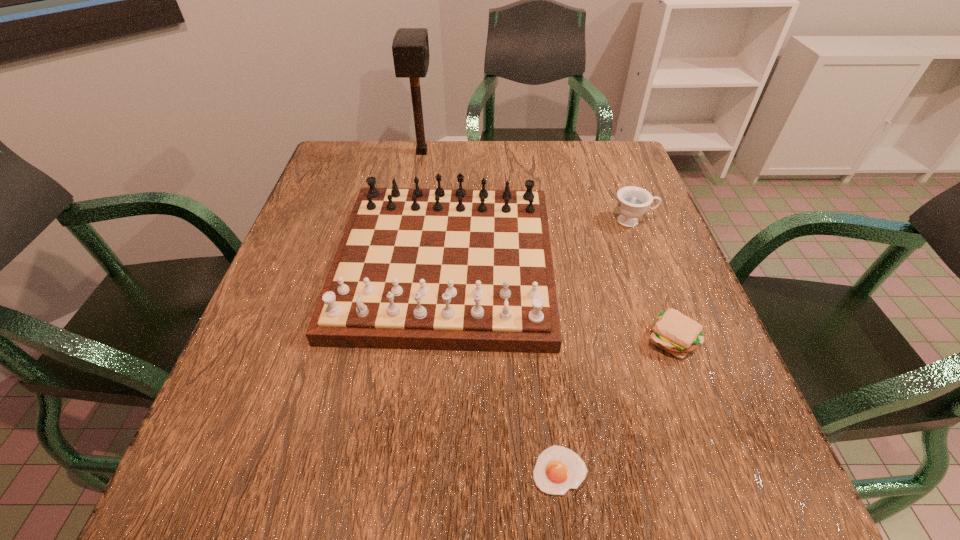
Where is `the farthest object`? Image resolution: width=960 pixels, height=540 pixels. the farthest object is located at coordinates (410, 47).

This screenshot has height=540, width=960. Identify the location of mallet. (410, 47).

Where is `the second tallest object`? The width and height of the screenshot is (960, 540). the second tallest object is located at coordinates (460, 269).

Identify the location of the third shortest object. (633, 201).

Find the location of `patty`. patty is located at coordinates (673, 332).

The height and width of the screenshot is (540, 960). In order to click on the shortest object in this screenshot , I will do `click(558, 469)`.

Identify the location of egg yolk. The width and height of the screenshot is (960, 540). (558, 469).

This screenshot has height=540, width=960. I want to click on vacant area situated 0.080m on the left of the farthest object, so click(x=382, y=152).

Locate an element on the screen. free point located on the right of the second tallest object is located at coordinates (632, 264).

Where is `free space located 0.060m on the left of the patty`? This screenshot has width=960, height=540. free space located 0.060m on the left of the patty is located at coordinates (613, 339).